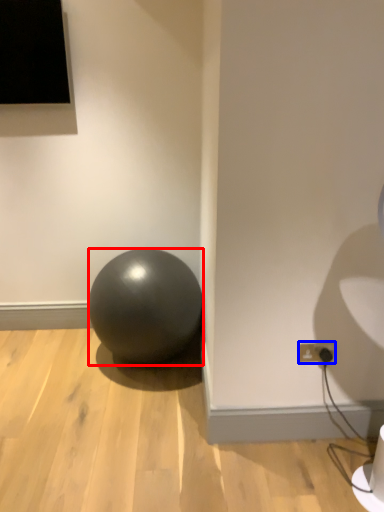
Question: Which object is further to the camera taking this photo, ball (highlighted by a red box) or electric outlet (highlighted by a blue box)?

Choices:
 (A) ball
 (B) electric outlet

Answer: (A)